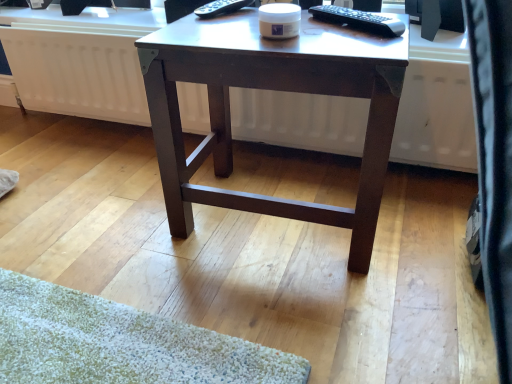
This screenshot has width=512, height=384. I want to click on vacant area that is in front of black plastic remote control at upper right, the second remote control in the left-to-right sequence, so click(343, 43).